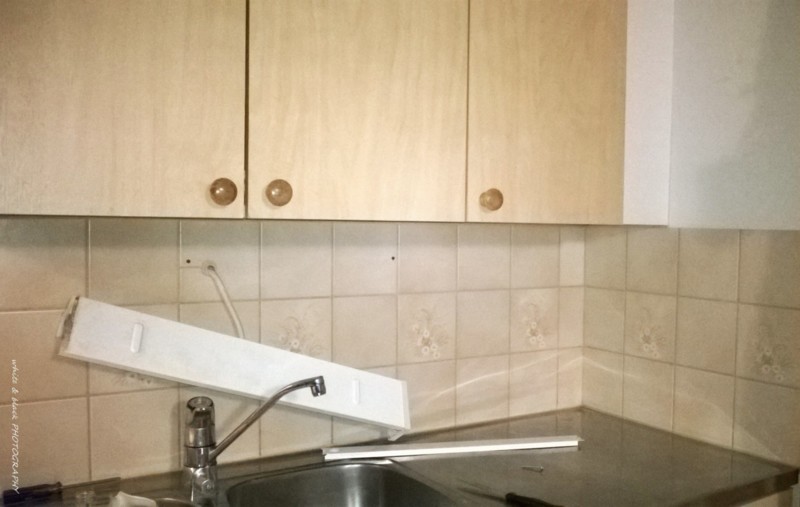
This screenshot has width=800, height=507. What are the coordinates of `faucet` in the screenshot? It's located at (297, 387).